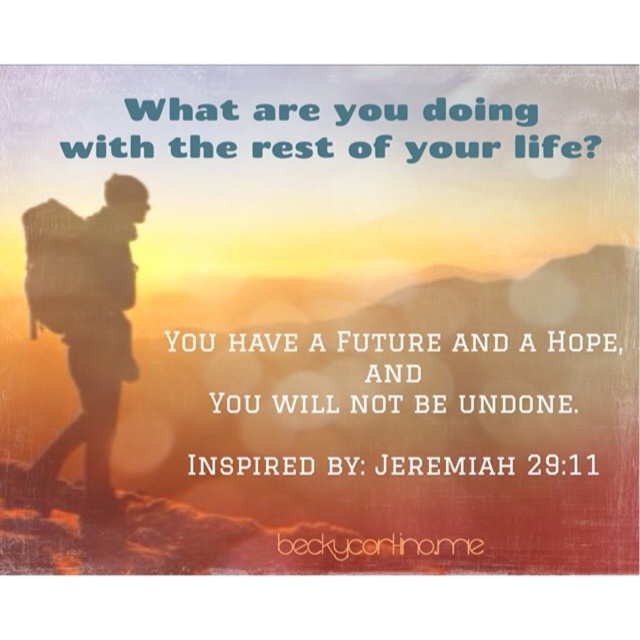
Who is positioned more to the left, silhouette backpack at left or blue text at upper center?

silhouette backpack at left is more to the left.

You are a GUI agent. You are given a task and a screenshot of the screen. Output one action in this format:
    pyautogui.click(x=<x>, y=<y>)
    Task: Click on the silhouette backpack at left
    The image size is (640, 640).
    Given the screenshot: What is the action you would take?
    pyautogui.click(x=86, y=323)

At what (x,y) coordinates should I click in order to perform the action: click on silhouette backpack at left. Please return your answer as a coordinate pair (x, y). The height and width of the screenshot is (640, 640). Looking at the image, I should click on (86, 323).

Who is more forward, [96,141] or [228,404]?

Point [96,141] is in front.

Find the location of a particular element. Image resolution: width=640 pixels, height=640 pixels. blue text at upper center is located at coordinates (554, 147).

Which is behind, point (80, 145) or point (316, 394)?

The point (316, 394) is behind.

What are the coordinates of `blue text at upper center` in the screenshot? It's located at (554, 147).

Where is `silhouette backpack at left`? The image size is (640, 640). silhouette backpack at left is located at coordinates (86, 323).

Is silhouette backpack at left shorter than white paper text at center?

Incorrect, silhouette backpack at left's height does not fall short of white paper text at center's.

The width and height of the screenshot is (640, 640). What are the coordinates of `silhouette backpack at left` in the screenshot? It's located at (86, 323).